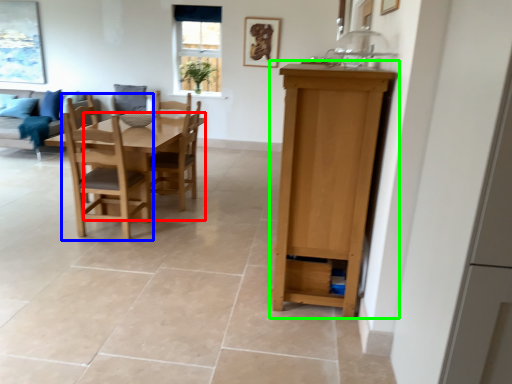
Question: Which is nearer to the table (highlighted by a red box)? chair (highlighted by a blue box) or cabinetry (highlighted by a green box).

Choices:
 (A) chair
 (B) cabinetry

Answer: (A)